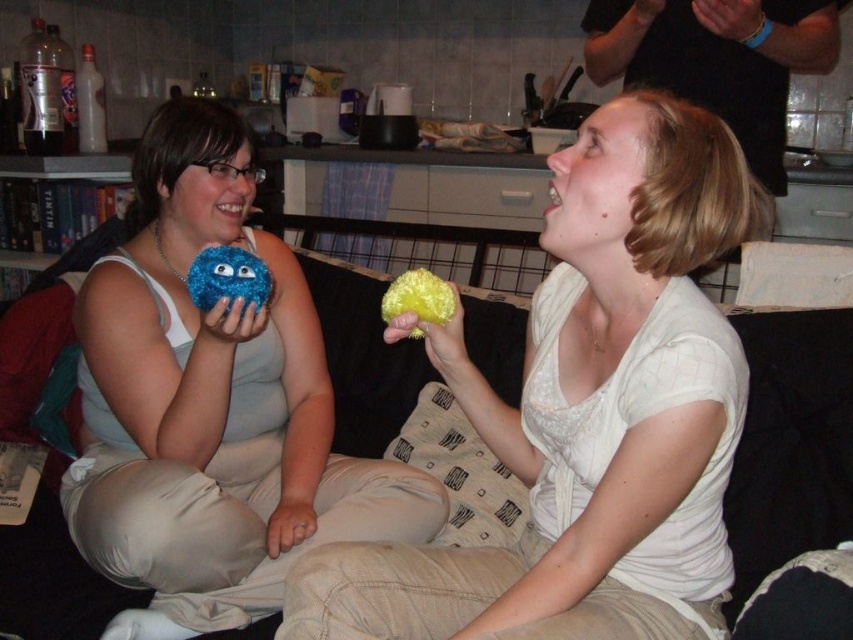
Who is higher up, matte blue plush toy at center or fuzzy blue ball at left?

fuzzy blue ball at left

Is matte blue plush toy at center positioned behind fuzzy blue ball at left?

Yes.

Between point (183, 333) and point (193, 280), which one is positioned in front?

Point (193, 280)

Find the location of a particular element. Image resolution: width=853 pixels, height=640 pixels. matte blue plush toy at center is located at coordinates [x=212, y=404].

Is point (201, 252) less distant than point (431, 300)?

No.

Does fuzzy blue ball at left appear over yellow fuzzy ball at center?

Yes.

The image size is (853, 640). Identify the location of fuzzy blue ball at left. (228, 276).

Describe the element at coordinates (589, 413) in the screenshot. Image resolution: width=853 pixels, height=640 pixels. I see `yellow fuzzy ball at upper right` at that location.

Does point (614, 403) come farther from viewer compared to point (418, 305)?

No, (614, 403) is closer to viewer.

Locate an element on the screen. The image size is (853, 640). yellow fuzzy ball at upper right is located at coordinates (589, 413).